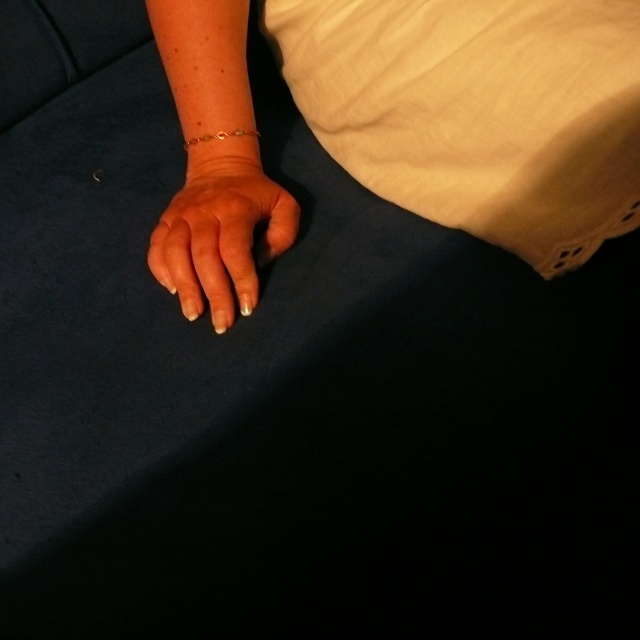
You are a photographer setting up a shoot. You see the white cotton pillow at upper right and the gold metallic bracelet at center in the frame. Which object is positioned higher in the image?

The white cotton pillow at upper right is positioned higher in the image than the gold metallic bracelet at center.

You are an artist sketching this scene. You want to ensure the gold metallic bracelet at center stands out against the smooth skin hand at center. Based on the scene description, what adjustment should you make to the bracelet in your drawing?

The smooth skin hand at center is in front of the gold metallic bracelet at center, so to make the bracelet stand out, you should draw it slightly behind the hand or use shading to create depth, ensuring it doesn not appear obscured.

Looking at this image, you are arranging a cozy reading corner and need to place the white cotton pillow at upper right and the gold metallic bracelet at center. According to the scene, which object is positioned to the right side of the other?

The white cotton pillow at upper right is to the right of the gold metallic bracelet at center.